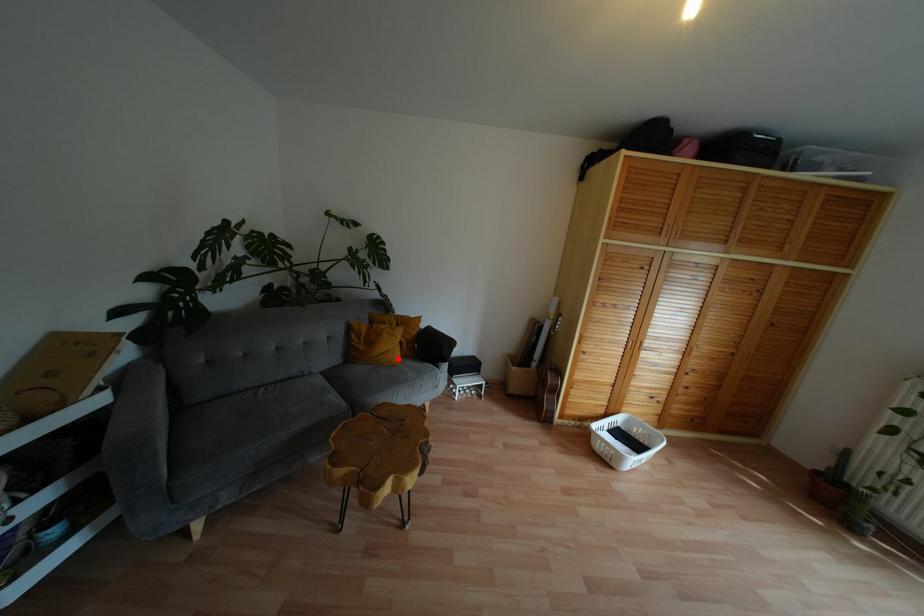
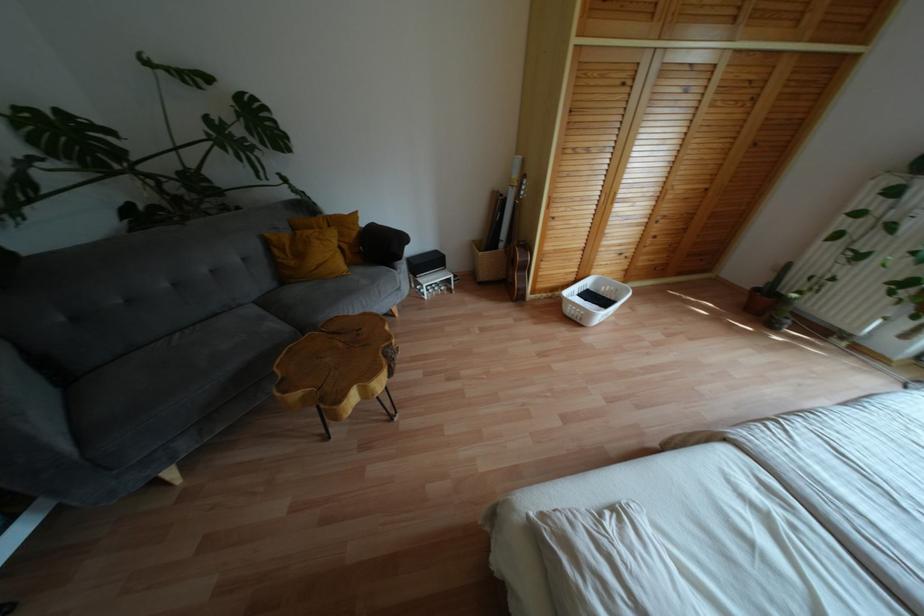
Find the pixel in the second image that matches the highlighted location in the first image.

(343, 267)